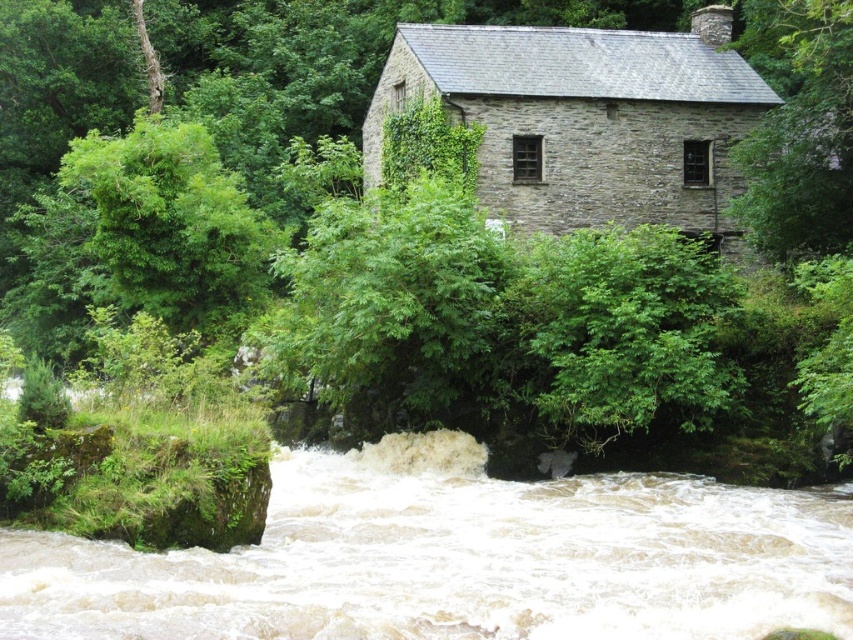
You are standing at the point labeled as point (343, 456) near the rustic stone building. You want to throw a rock to reach the viewer who is 30.03 meters away. Is this distance within your throwing range if your maximum throwing distance is 25 meters?

The distance between you and the viewer is 30.03 meters, which exceeds your maximum throwing range of 25 meters. Therefore, you cannot reach the viewer by throwing a rock from point (343, 456).

You are a hiker carrying a heavy backpack and need to cross the river to reach the rustic stone building. The white frothy water at lower center is the only visible obstacle. Can you safely cross the river at this point?

The distance between you and the rustic stone building is 11.59 meters, but the white frothy water at lower center indicates strong currents and turbulent water, making it unsafe to cross here with a heavy backpack.

You are a hiker who wants to cross the river using a narrow wooden bridge. You see the white frothy water at lower center and the green leafy tree at center. Which object is narrower in width?

The white frothy water at lower center is thinner than the green leafy tree at center, so the white frothy water at lower center is narrower in width.